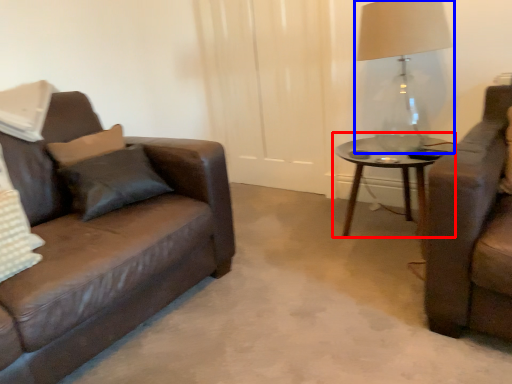
Question: Which of the following is the closest to the observer, coffee table (highlighted by a red box) or table lamp (highlighted by a blue box)?

Choices:
 (A) coffee table
 (B) table lamp

Answer: (B)